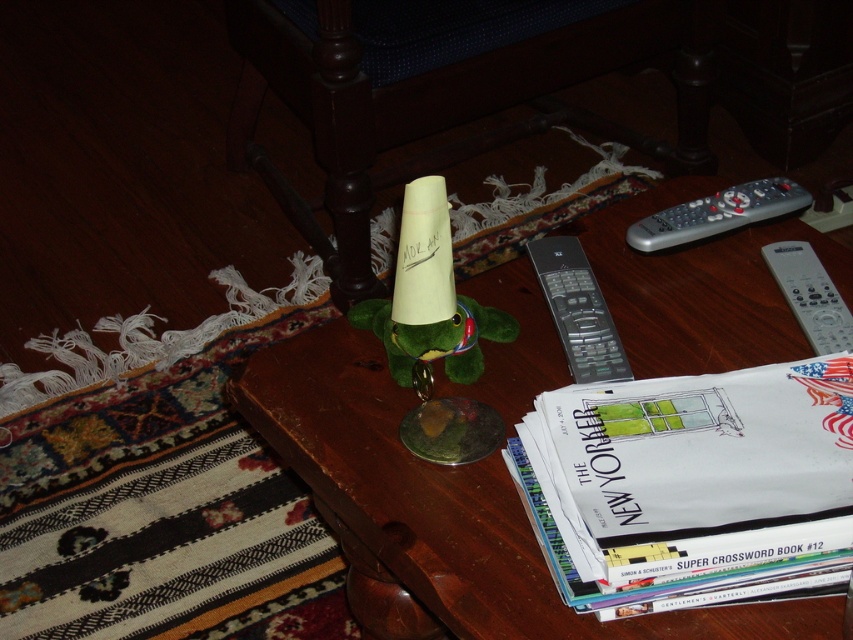
Question: Does wooden table at center appear on the right side of silver metallic remote at upper right?

Choices:
 (A) yes
 (B) no

Answer: (B)

Question: Among these points, which one is farthest from the camera?

Choices:
 (A) (817, 449)
 (B) (566, 252)

Answer: (B)

Question: Does wooden table at center have a larger size compared to silver metallic remote at upper right?

Choices:
 (A) no
 (B) yes

Answer: (B)

Question: Which of the following is the farthest from the observer?

Choices:
 (A) black plastic remote at center
 (B) white plastic remote at right
 (C) silver metallic remote at upper right
 (D) wooden table at center

Answer: (C)

Question: Considering the real-world distances, which object is closest to the white paper book at lower right?

Choices:
 (A) black plastic remote at center
 (B) white plastic remote at right
 (C) wooden table at center
 (D) silver metallic remote at upper right

Answer: (C)

Question: Is white paper book at lower right closer to camera compared to black plastic remote at center?

Choices:
 (A) no
 (B) yes

Answer: (B)